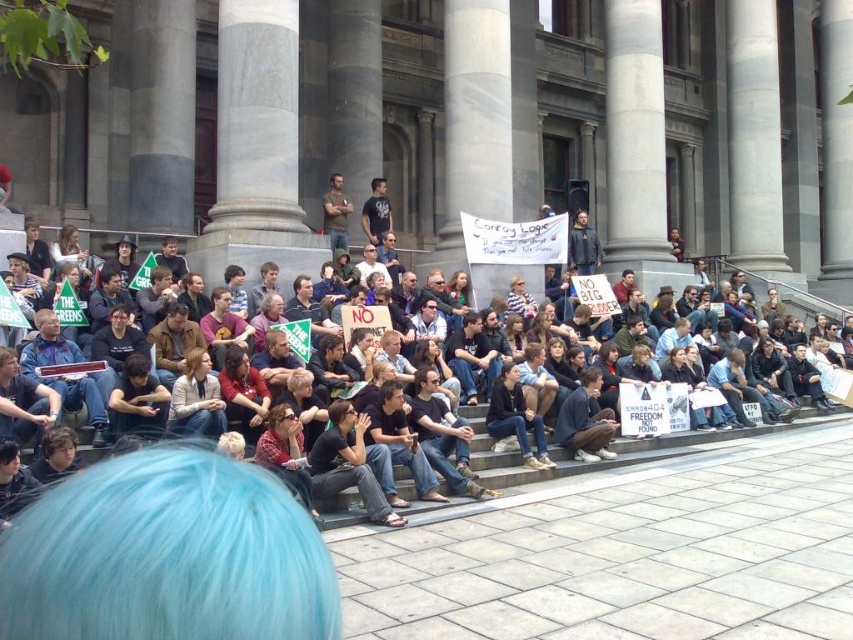
You are a photographer standing at the bottom of the steps where the crowd is seated. You want to take a photo of the matte black sign at center and the dark brown leather jacket at center. Which object will appear closer to the camera in the photo?

The matte black sign at center appears closer to the camera because it is in front of the dark brown leather jacket at center.